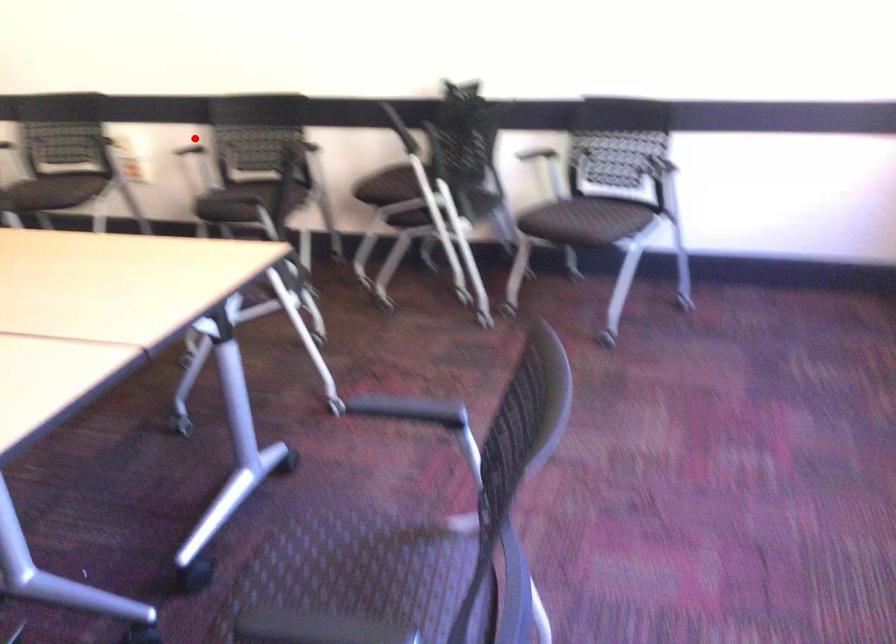
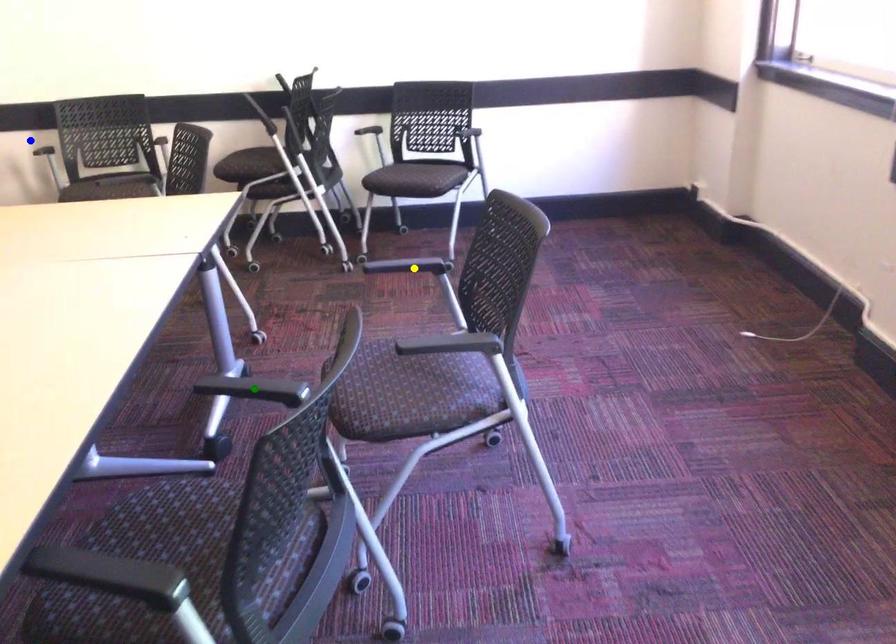
Question: I am providing you with two images of the same scene from different viewpoints. A red point is marked on the first image. You are given multiple points on the second image. Which spot in image 2 lines up with the point in image 1?

Choices:
 (A) yellow point
 (B) green point
 (C) blue point

Answer: (C)